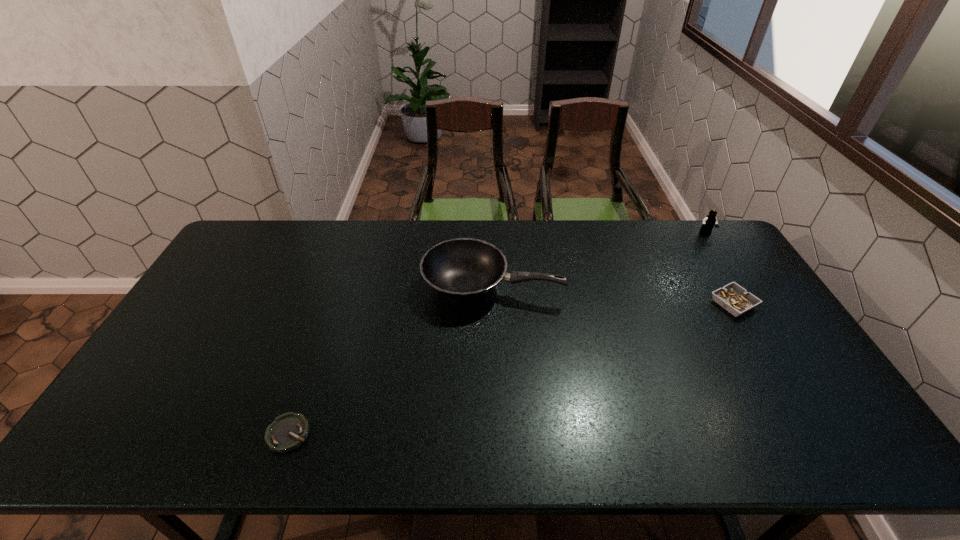
Identify the location of the third object from right to left. (463, 269).

The width and height of the screenshot is (960, 540). Find the location of `the farthest object`. the farthest object is located at coordinates (709, 221).

The width and height of the screenshot is (960, 540). I want to click on the third tallest object, so click(x=735, y=299).

Where is `the taller ashtray`? This screenshot has height=540, width=960. the taller ashtray is located at coordinates (735, 299).

Locate an element on the screen. The width and height of the screenshot is (960, 540). the nearer ashtray is located at coordinates (288, 431).

Image resolution: width=960 pixels, height=540 pixels. I want to click on the shorter ashtray, so click(288, 431).

The image size is (960, 540). What are the coordinates of `vacant region located on the back of the frying pan` in the screenshot? It's located at (492, 244).

This screenshot has height=540, width=960. What are the coordinates of `vacant space located 0.090m on the front-facing side of the farthest object` in the screenshot? It's located at (717, 251).

The height and width of the screenshot is (540, 960). I want to click on free space located 0.220m on the left of the farther ashtray, so click(x=639, y=304).

You are a GUI agent. You are given a task and a screenshot of the screen. Output one action in this format:
    pyautogui.click(x=<x>, y=<y>)
    Task: Click on the vacant area situated 0.140m on the right of the leftmost object
    
    Given the screenshot: What is the action you would take?
    pyautogui.click(x=369, y=434)